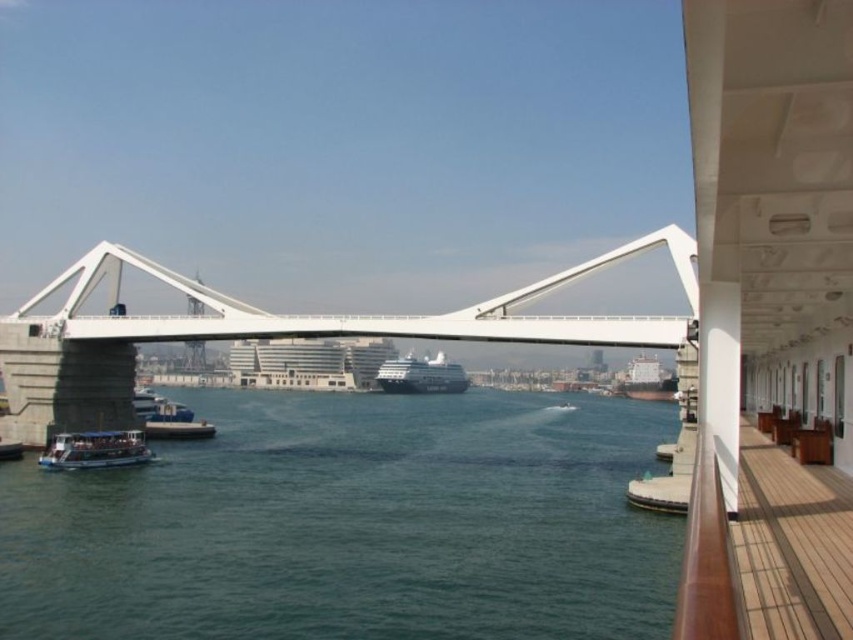
Is green matte boat at lower left thinner than dark gray metallic ship at center?

Yes, green matte boat at lower left is thinner than dark gray metallic ship at center.

Does point (88, 440) come behind point (398, 381)?

That is False.

Identify the location of green matte boat at lower left. (96, 449).

Does greenish-blue water at center have a lesser width compared to white metallic bridge at center?

In fact, greenish-blue water at center might be wider than white metallic bridge at center.

Does greenish-blue water at center lie behind white metallic bridge at center?

No, it is not.

Between point (646, 403) and point (27, 372), which one is positioned in front?

Positioned in front is point (27, 372).

Identify the location of greenish-blue water at center. (352, 524).

Is white metallic bridge at center above dark gray metallic ship at center?

Yes.

What are the coordinates of `white metallic bridge at center` in the screenshot? It's located at (267, 332).